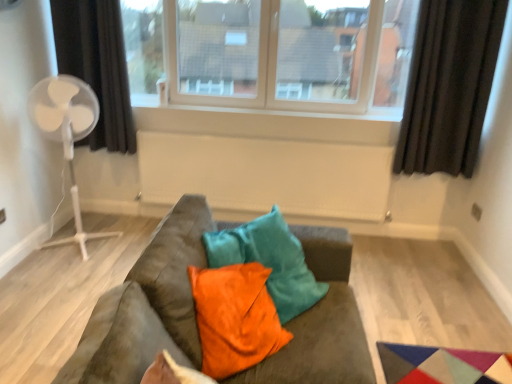
Question: From a real-world perspective, is white matte radiator at center positioned under orange velvet pillow at center based on gravity?

Choices:
 (A) yes
 (B) no

Answer: (A)

Question: Can you confirm if white matte radiator at center is smaller than orange velvet pillow at center?

Choices:
 (A) no
 (B) yes

Answer: (A)

Question: Considering the relative sizes of white matte radiator at center and orange velvet pillow at center in the image provided, is white matte radiator at center bigger than orange velvet pillow at center?

Choices:
 (A) yes
 (B) no

Answer: (A)

Question: Can you confirm if white matte radiator at center is thinner than orange velvet pillow at center?

Choices:
 (A) no
 (B) yes

Answer: (B)

Question: Is the position of white matte radiator at center more distant than that of orange velvet pillow at center?

Choices:
 (A) yes
 (B) no

Answer: (A)

Question: Choose the correct answer: Is transparent glass window at center inside white plastic fan at left or outside it?

Choices:
 (A) inside
 (B) outside

Answer: (B)

Question: From a real-world perspective, is transparent glass window at center physically located above or below white plastic fan at left?

Choices:
 (A) above
 (B) below

Answer: (A)

Question: In terms of height, does transparent glass window at center look taller or shorter compared to white plastic fan at left?

Choices:
 (A) short
 (B) tall

Answer: (A)

Question: Looking at their shapes, would you say transparent glass window at center is wider or thinner than white plastic fan at left?

Choices:
 (A) thin
 (B) wide

Answer: (A)

Question: Is white plastic window sill at upper center in front of or behind suede-like brown couch at center in the image?

Choices:
 (A) front
 (B) behind

Answer: (B)

Question: Looking at the image, does white plastic window sill at upper center seem bigger or smaller compared to suede-like brown couch at center?

Choices:
 (A) big
 (B) small

Answer: (B)

Question: Choose the correct answer: Is white plastic window sill at upper center inside suede-like brown couch at center or outside it?

Choices:
 (A) outside
 (B) inside

Answer: (A)

Question: In the image, is white plastic window sill at upper center on the left side or the right side of suede-like brown couch at center?

Choices:
 (A) right
 (B) left

Answer: (A)

Question: Considering the relative positions of suede-like brown couch at center and white plastic window sill at upper center in the image provided, is suede-like brown couch at center to the left or to the right of white plastic window sill at upper center?

Choices:
 (A) left
 (B) right

Answer: (A)

Question: Choose the correct answer: Is suede-like brown couch at center inside white plastic window sill at upper center or outside it?

Choices:
 (A) outside
 (B) inside

Answer: (A)